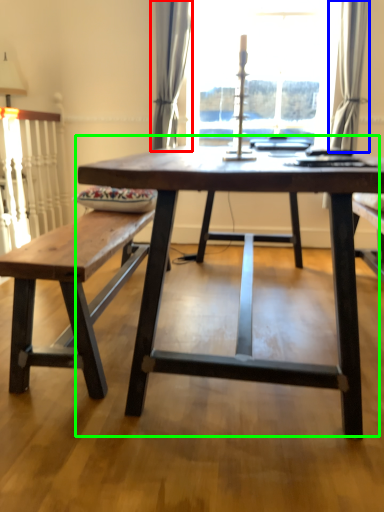
Question: Considering the real-world distances, which object is closest to curtain (highlighted by a red box)? curtain (highlighted by a blue box) or coffee table (highlighted by a green box).

Choices:
 (A) curtain
 (B) coffee table

Answer: (A)